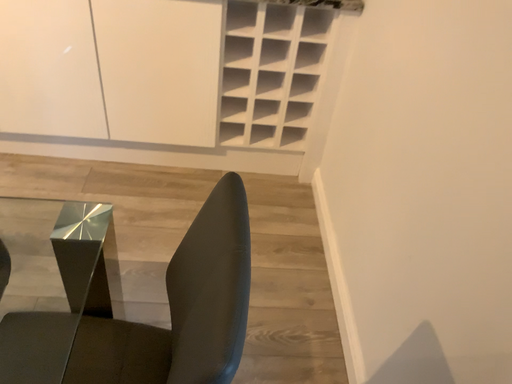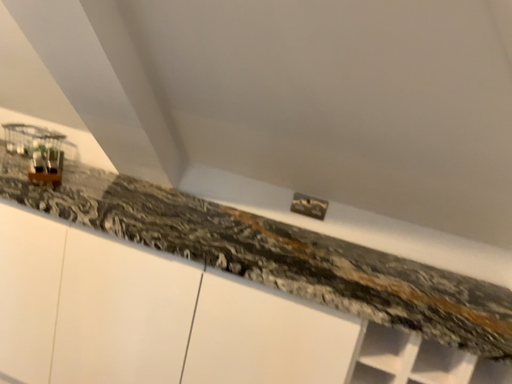
Question: Which way did the camera rotate in the video?

Choices:
 (A) rotated upward
 (B) rotated downward

Answer: (A)